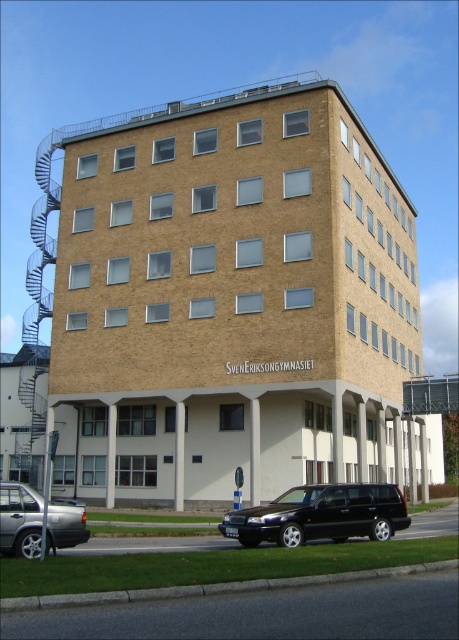
Can you confirm if black metallic car at lower center is positioned above silver metallic sedan at lower left?

Actually, black metallic car at lower center is below silver metallic sedan at lower left.

Is point (247, 515) farther from camera compared to point (43, 508)?

Yes, it is behind point (43, 508).

Who is more distant from viewer, (x=391, y=508) or (x=83, y=512)?

The point (x=391, y=508) is behind.

What are the coordinates of `black metallic car at lower center` in the screenshot? It's located at (320, 515).